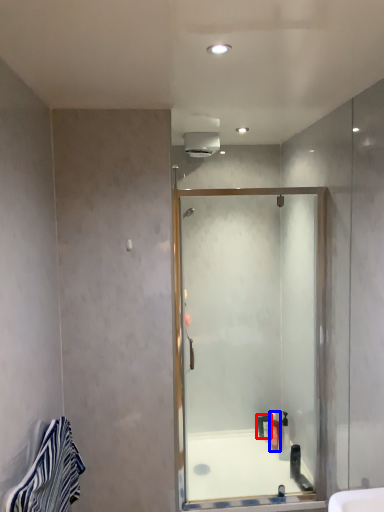
Question: Which object appears closest to the camera in this image, toiletry (highlighted by a red box) or toiletry (highlighted by a blue box)?

Choices:
 (A) toiletry
 (B) toiletry

Answer: (B)